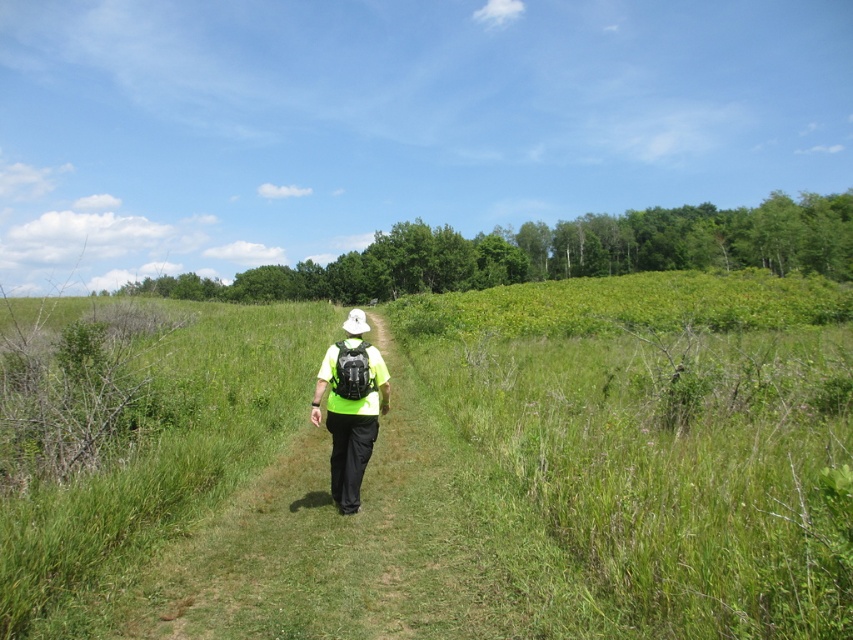
Is green grassy at center above matte black backpack at center?

Correct, green grassy at center is located above matte black backpack at center.

Who is higher up, green grassy at center or matte black backpack at center?

Positioned higher is green grassy at center.

Where is `green grassy at center`? This screenshot has width=853, height=640. green grassy at center is located at coordinates (436, 465).